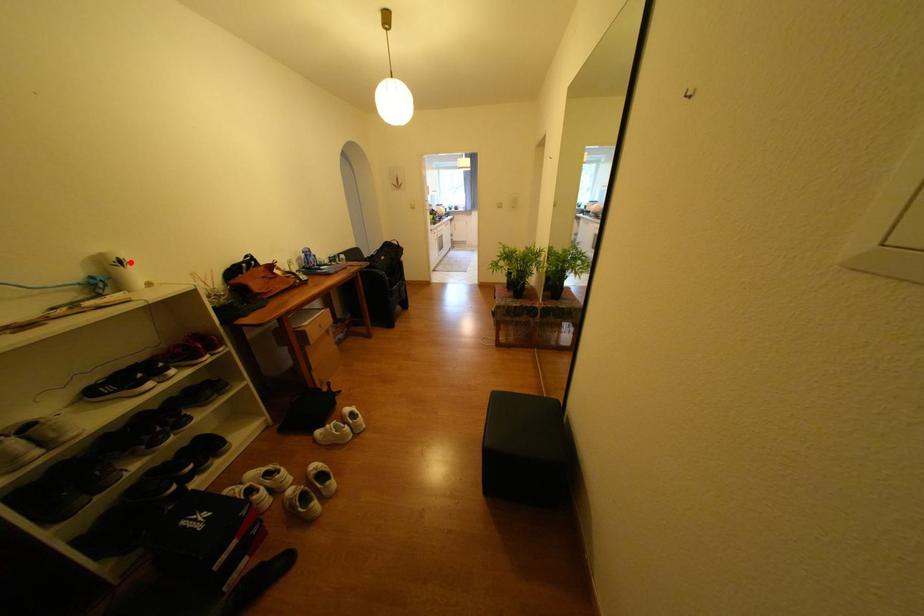
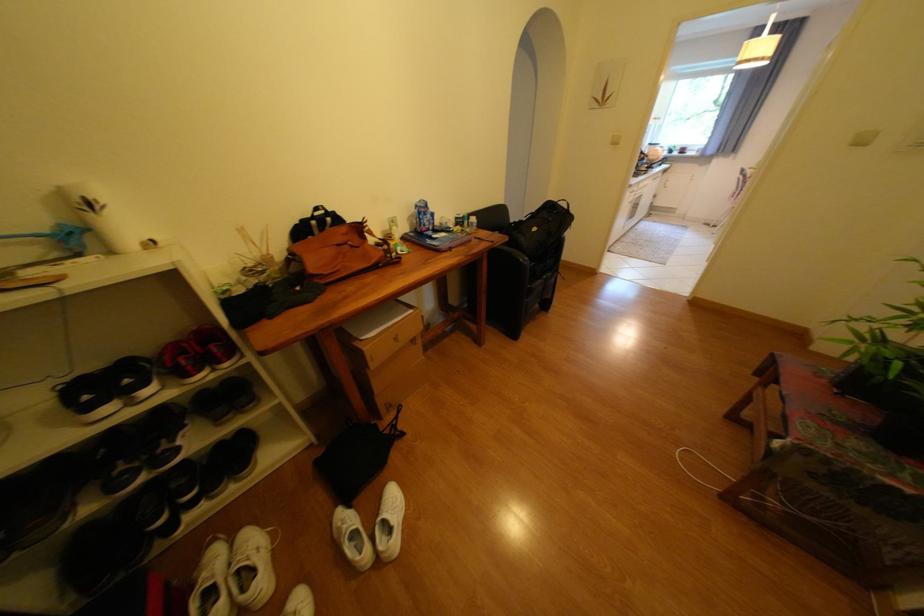
Where in the second image is the point corresponding to the highlighted location from the first image?

(100, 205)